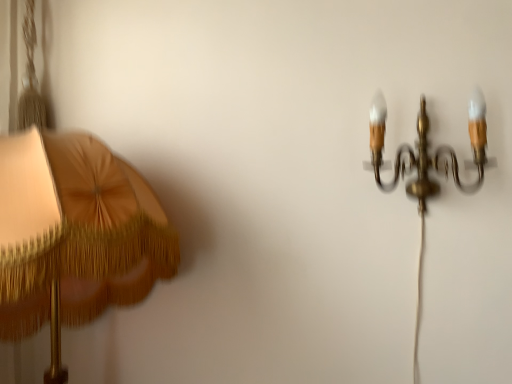
Question: Is matte gold lampshade at left, the 2th lamp viewed from the right, next to gold brass chandelier at upper right, the 2th lamp from the left?

Choices:
 (A) no
 (B) yes

Answer: (A)

Question: Can you confirm if matte gold lampshade at left, which appears as the 1th lamp when viewed from the left, is positioned to the right of gold brass chandelier at upper right, the first lamp viewed from the right?

Choices:
 (A) yes
 (B) no

Answer: (B)

Question: Does matte gold lampshade at left, which appears as the 1th lamp when viewed from the left, come behind gold brass chandelier at upper right, the 2th lamp from the left?

Choices:
 (A) no
 (B) yes

Answer: (A)

Question: Is matte gold lampshade at left, the 2th lamp viewed from the right, outside of gold brass chandelier at upper right, the 2th lamp from the left?

Choices:
 (A) yes
 (B) no

Answer: (A)

Question: Is matte gold lampshade at left, which appears as the 1th lamp when viewed from the left, shorter than gold brass chandelier at upper right, the 2th lamp from the left?

Choices:
 (A) yes
 (B) no

Answer: (B)

Question: Is gold brass chandelier at upper right, the first lamp viewed from the right, a part of matte gold lampshade at left, the 2th lamp viewed from the right?

Choices:
 (A) yes
 (B) no

Answer: (B)

Question: From a real-world perspective, is gold brass chandelier at upper right, the first lamp viewed from the right, located beneath matte gold lampshade at left, the 2th lamp viewed from the right?

Choices:
 (A) no
 (B) yes

Answer: (A)

Question: Is gold brass chandelier at upper right, the first lamp viewed from the right, placed right next to matte gold lampshade at left, the 2th lamp viewed from the right?

Choices:
 (A) no
 (B) yes

Answer: (A)

Question: Would you consider gold brass chandelier at upper right, the first lamp viewed from the right, to be distant from matte gold lampshade at left, which appears as the 1th lamp when viewed from the left?

Choices:
 (A) no
 (B) yes

Answer: (A)

Question: Would you say gold brass chandelier at upper right, the 2th lamp from the left, is outside matte gold lampshade at left, the 2th lamp viewed from the right?

Choices:
 (A) no
 (B) yes

Answer: (B)

Question: Is gold brass chandelier at upper right, the 2th lamp from the left, bigger than matte gold lampshade at left, the 2th lamp viewed from the right?

Choices:
 (A) no
 (B) yes

Answer: (A)

Question: Considering the relative sizes of gold brass chandelier at upper right, the first lamp viewed from the right, and matte gold lampshade at left, the 2th lamp viewed from the right, in the image provided, is gold brass chandelier at upper right, the first lamp viewed from the right, thinner than matte gold lampshade at left, the 2th lamp viewed from the right,?

Choices:
 (A) no
 (B) yes

Answer: (B)

Question: Considering the positions of matte gold lampshade at left, which appears as the 1th lamp when viewed from the left, and gold brass chandelier at upper right, the first lamp viewed from the right, in the image, is matte gold lampshade at left, which appears as the 1th lamp when viewed from the left, bigger or smaller than gold brass chandelier at upper right, the first lamp viewed from the right,?

Choices:
 (A) big
 (B) small

Answer: (A)